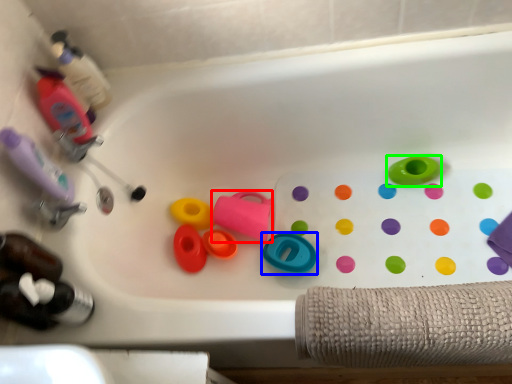
Question: Which object is the farthest from toy (highlighted by a red box)? Choose among these: toy (highlighted by a blue box) or toy (highlighted by a green box).

Choices:
 (A) toy
 (B) toy

Answer: (B)